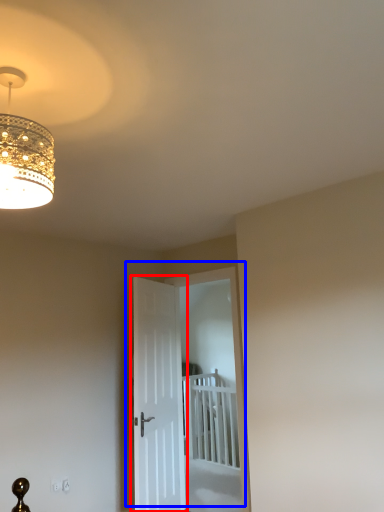
Question: Which object appears farthest to the camera in this image, door (highlighted by a red box) or door (highlighted by a blue box)?

Choices:
 (A) door
 (B) door

Answer: (B)